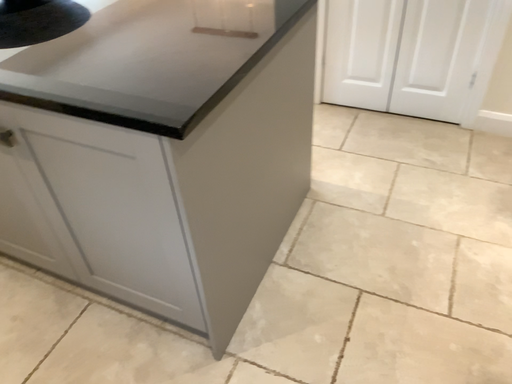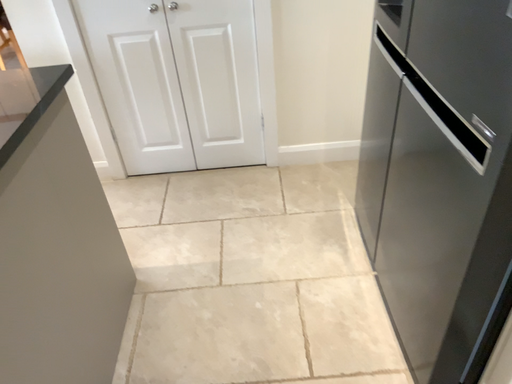
Question: How did the camera likely rotate when shooting the video?

Choices:
 (A) rotated downward
 (B) rotated upward

Answer: (B)